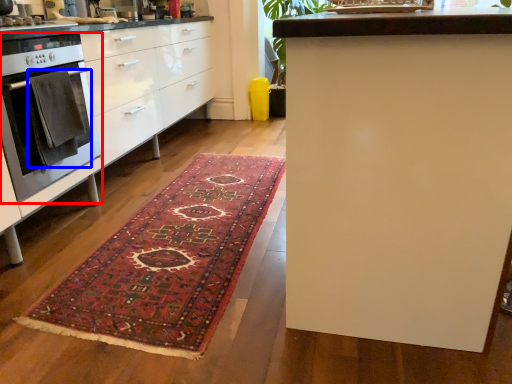
Question: Which of the following is the farthest to the observer, home appliance (highlighted by a red box) or blanket (highlighted by a blue box)?

Choices:
 (A) home appliance
 (B) blanket

Answer: (B)